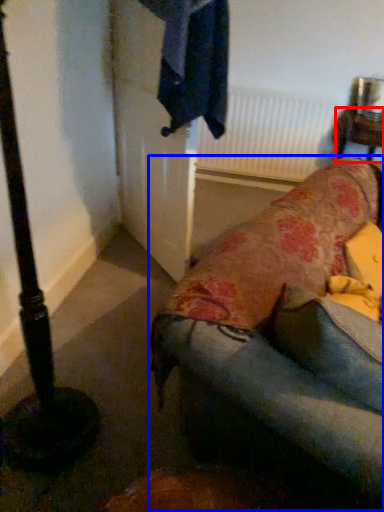
Question: Among these objects, which one is nearest to the camera, furniture (highlighted by a red box) or studio couch (highlighted by a blue box)?

Choices:
 (A) furniture
 (B) studio couch

Answer: (B)